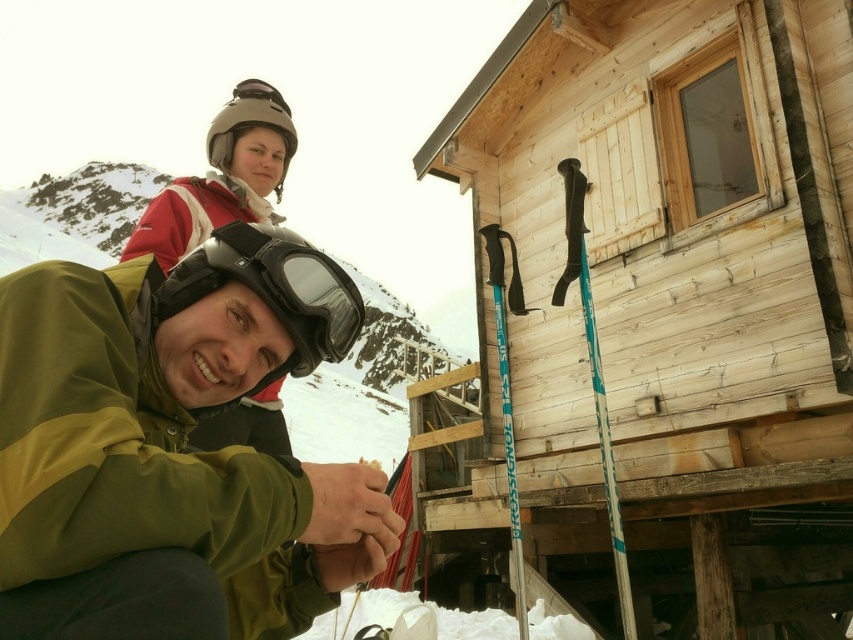
Is weathered wood cabin at center closer to camera compared to green matte jacket at lower left?

No, it is not.

Find the location of a particular element. The image size is (853, 640). weathered wood cabin at center is located at coordinates (662, 312).

Does green matte jacket at lower left appear on the left side of matte gray helmet at upper center?

Incorrect, green matte jacket at lower left is not on the left side of matte gray helmet at upper center.

Which is behind, point (323, 529) or point (276, 182)?

The point (276, 182) is behind.

This screenshot has width=853, height=640. Identify the location of green matte jacket at lower left. (173, 448).

Consider the image. Is weathered wood cabin at center to the left of matte gray helmet at upper center from the viewer's perspective?

Incorrect, weathered wood cabin at center is not on the left side of matte gray helmet at upper center.

Does weathered wood cabin at center have a smaller size compared to matte gray helmet at upper center?

Actually, weathered wood cabin at center might be larger than matte gray helmet at upper center.

Is point (850, 336) positioned in front of point (286, 125)?

Yes.

In order to click on weathered wood cabin at center in this screenshot , I will do `click(662, 312)`.